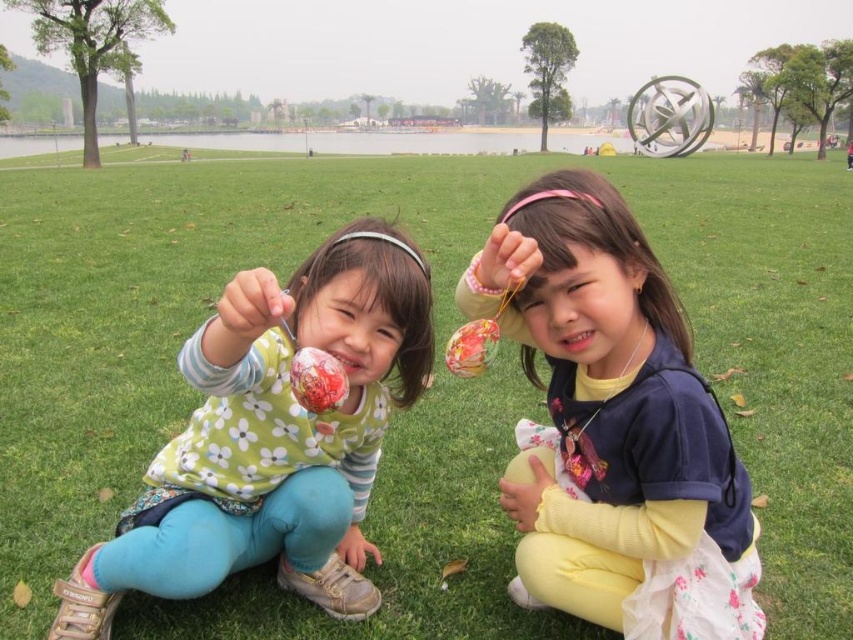
Based on the photo, you are a photographer trying to capture both the matte floral shirt at center and the matte plastic hand at center in a single frame. Which object should you focus on first to ensure both fit in the photo?

The matte floral shirt at center is wider than the matte plastic hand at center, so you should focus on capturing the matte floral shirt at center first to ensure both fit in the photo.

What is the location of the point marked at coordinates (250, 307) in the image?

The point marked at coordinates (250, 307) is located on the matte plastic hand at center.

You are a photographer standing in the park where the two children are playing. You want to take a photo that includes both the matte floral shirt at center and the matte plastic hand at center. What is the minimum distance you need to move backward to ensure both objects are fully visible in your camera frame?

The minimum distance you need to move backward is determined by the distance between the matte floral shirt at center and the matte plastic hand at center, which are 29.02 inches apart. To capture both in the frame, you should position yourself far enough back so that the camera can encompass the 29.02 inches between them.